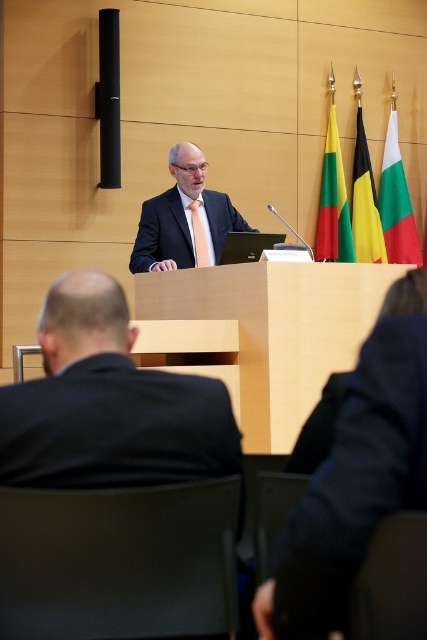
Consider the image. You are standing in the audience and want to point to the exact location of the point at coordinates point (108, 403). According to the scene description, where would that point be located?

The point at coordinates point (108, 403) is located on the black suit at lower left.

You are standing in the front row of the audience facing the speaker. Where is the black suit at lower left located in relation to your position?

The black suit at lower left is located to your left side at coordinates approximately 0.631 on the x axis and 0.255 on the y axis.